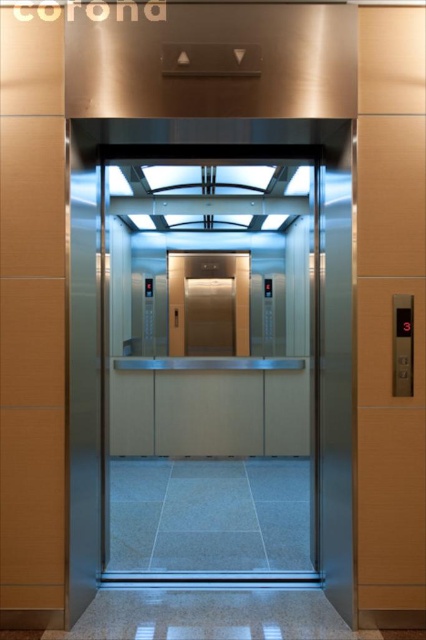
Can you confirm if transparent glass elevator at center is bigger than polished brass elevator at center?

Correct, transparent glass elevator at center is larger in size than polished brass elevator at center.

Is transparent glass elevator at center to the left of polished brass elevator at center from the viewer's perspective?

Incorrect, transparent glass elevator at center is not on the left side of polished brass elevator at center.

Where is `transparent glass elevator at center`? transparent glass elevator at center is located at coordinates (212, 364).